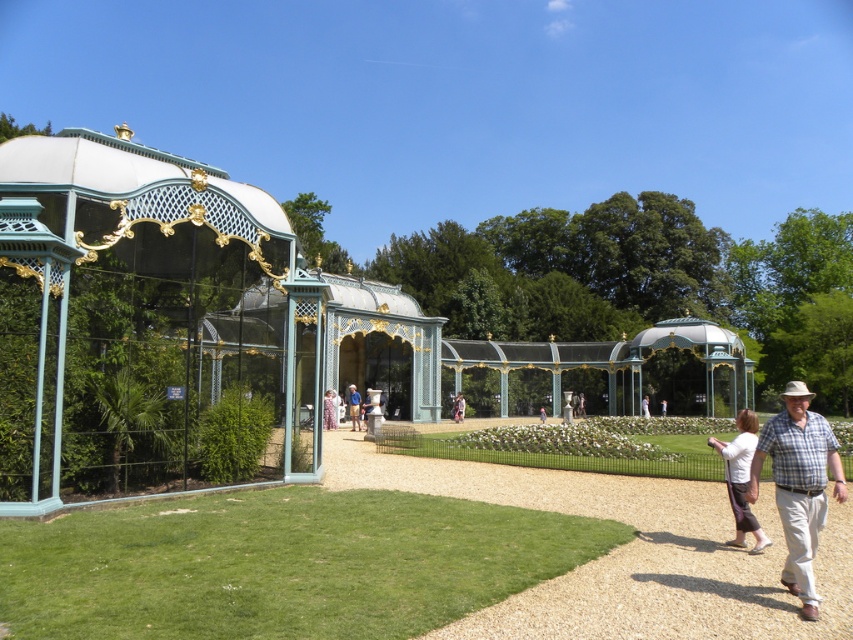
In the scene shown: You are a visitor in the garden and want to take a photo of both the plaid shirt at lower right and the matte white statue at center. Can you stand at a point where both are visible in the same frame without moving either object?

The plaid shirt at lower right and matte white statue at center are 104.28 feet apart from each other, so yes, you can stand at a point where both are visible in the same frame without moving either object since the distance between them is manageable for a wide enough camera angle.

You are standing at the entrance of the garden and see the plaid shirt at lower right and the matte white statue at center. Which object is closer to you?

The plaid shirt at lower right is closer to you since it is in front of the matte white statue at center.